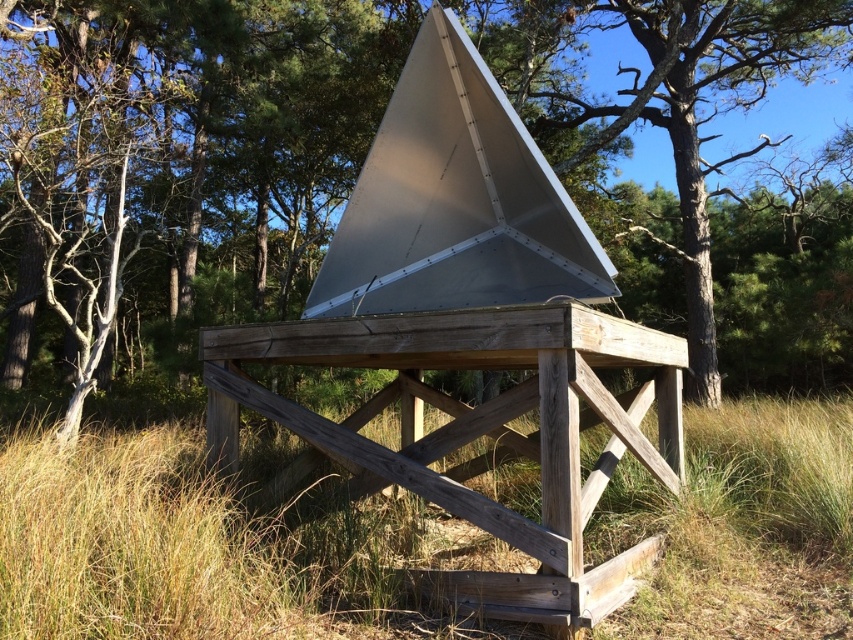
Question: Which point is farther from the camera taking this photo?

Choices:
 (A) (59, 509)
 (B) (607, 570)
 (C) (294, 211)

Answer: (C)

Question: Which point is farther to the camera?

Choices:
 (A) wooden picnic table at center
 (B) brown grass at lower center

Answer: (A)

Question: Among these points, which one is nearest to the camera?

Choices:
 (A) (479, 419)
 (B) (753, 397)

Answer: (A)

Question: Can you confirm if matte silver pyramid at center is positioned to the left of wooden picnic table at center?

Choices:
 (A) no
 (B) yes

Answer: (A)

Question: Does matte silver pyramid at center lie behind wooden picnic table at center?

Choices:
 (A) yes
 (B) no

Answer: (A)

Question: Can you confirm if matte silver pyramid at center is bigger than wooden picnic table at center?

Choices:
 (A) no
 (B) yes

Answer: (B)